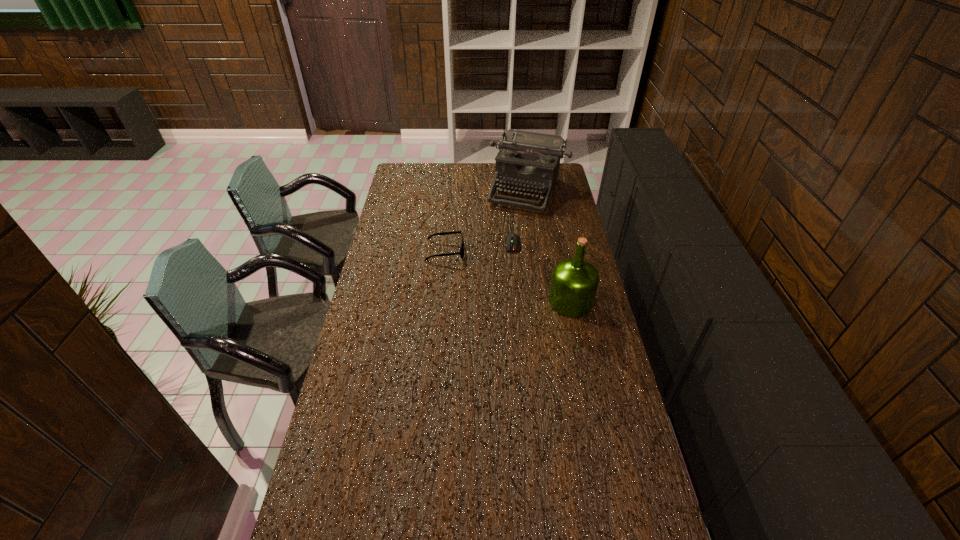
Image resolution: width=960 pixels, height=540 pixels. What are the coordinates of `the third tallest object` in the screenshot? It's located at (461, 252).

Find the location of a particular element. This screenshot has width=960, height=540. the leftmost object is located at coordinates (461, 252).

At what (x,y) coordinates should I click in order to perform the action: click on the nearest object. Please return your answer as a coordinate pair (x, y). Image resolution: width=960 pixels, height=540 pixels. Looking at the image, I should click on (574, 283).

At what (x,y) coordinates should I click in order to perform the action: click on the tallest object. Please return your answer as a coordinate pair (x, y). Image resolution: width=960 pixels, height=540 pixels. Looking at the image, I should click on (574, 283).

In order to click on typewriter in this screenshot , I will do `click(530, 161)`.

Find the location of a particular element. the second tallest object is located at coordinates (530, 161).

Where is `the shortest object`? The image size is (960, 540). the shortest object is located at coordinates (511, 240).

Locate an element on the screen. The width and height of the screenshot is (960, 540). free location located on the front-facing side of the third tallest object is located at coordinates (492, 251).

At what (x,y) coordinates should I click in order to perform the action: click on vacant position located 0.230m on the back of the olive oil. Please return your answer as a coordinate pair (x, y). This screenshot has width=960, height=540. Looking at the image, I should click on (560, 249).

Find the location of a particular element. The image size is (960, 540). blank space located 0.130m on the typing side of the typewriter is located at coordinates (511, 230).